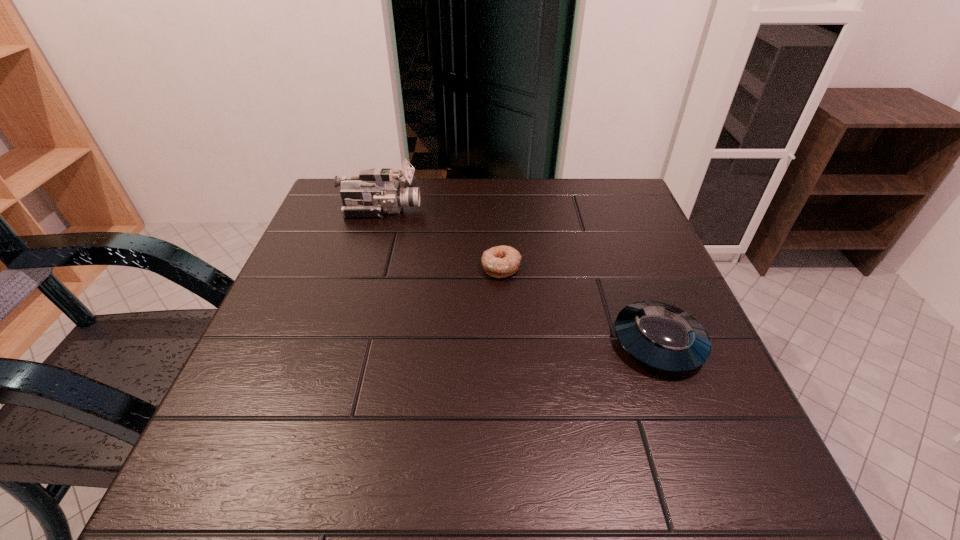
Identify the location of vacant area in the image that satisfies the following two spatial constraints: 1. on the front-facing side of the doughnut; 2. on the right side of the tallest object. This screenshot has width=960, height=540. (364, 267).

I want to click on vacant area that satisfies the following two spatial constraints: 1. on the front-facing side of the doughnut; 2. on the right side of the farthest object, so click(x=364, y=267).

This screenshot has width=960, height=540. I want to click on free space that satisfies the following two spatial constraints: 1. on the front-facing side of the nearest object; 2. on the left side of the farthest object, so click(342, 342).

Locate an element on the screen. The height and width of the screenshot is (540, 960). free spot that satisfies the following two spatial constraints: 1. on the back side of the rightmost object; 2. on the front-facing side of the tallest object is located at coordinates (607, 210).

Identify the location of vacant region that satisfies the following two spatial constraints: 1. on the front-facing side of the camcorder; 2. on the left side of the second nearest object. (364, 267).

The image size is (960, 540). I want to click on vacant position in the image that satisfies the following two spatial constraints: 1. on the front-facing side of the leftmost object; 2. on the left side of the rightmost object, so click(x=342, y=342).

Image resolution: width=960 pixels, height=540 pixels. What are the coordinates of `free region that satisfies the following two spatial constraints: 1. on the front-facing side of the leftmost object; 2. on the right side of the shortest object` in the screenshot? It's located at (364, 267).

Where is `vacant space that satisfies the following two spatial constraints: 1. on the front-facing side of the camcorder; 2. on the back side of the doughnut`? The height and width of the screenshot is (540, 960). vacant space that satisfies the following two spatial constraints: 1. on the front-facing side of the camcorder; 2. on the back side of the doughnut is located at coordinates (364, 267).

Find the location of a particular element. The width and height of the screenshot is (960, 540). free space that satisfies the following two spatial constraints: 1. on the front-facing side of the doughnut; 2. on the right side of the leftmost object is located at coordinates (364, 267).

Locate an element on the screen. This screenshot has height=540, width=960. free location that satisfies the following two spatial constraints: 1. on the back side of the doughnut; 2. on the front-facing side of the camcorder is located at coordinates (498, 210).